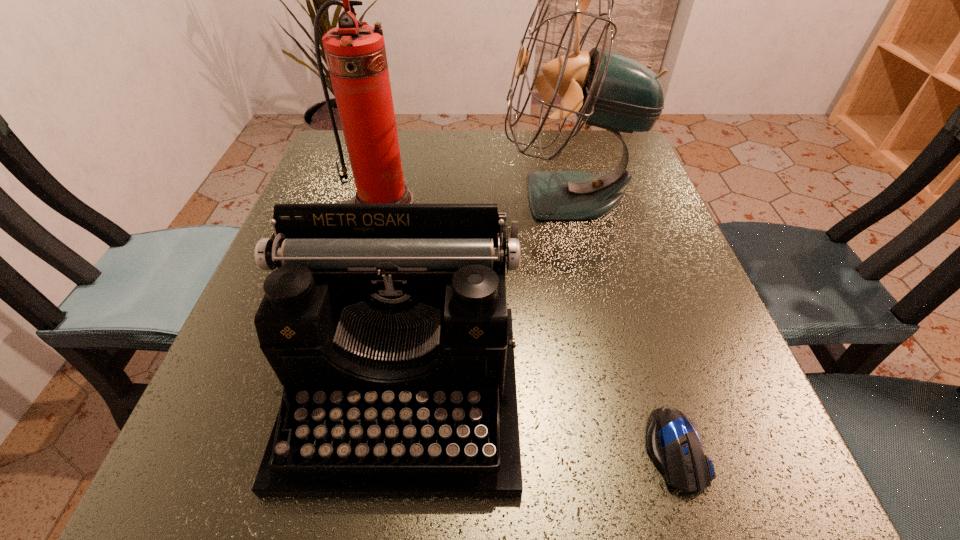
Locate an element on the screen. computer mouse at the near edge is located at coordinates (673, 442).

You are a GUI agent. You are given a task and a screenshot of the screen. Output one action in this format:
    pyautogui.click(x=<x>, y=<y>)
    Task: Click on the fire extinguisher that is at the left edge
    This screenshot has height=540, width=960.
    Given the screenshot: What is the action you would take?
    pyautogui.click(x=355, y=52)

Where is `typewriter positioned at the left edge`? This screenshot has width=960, height=540. typewriter positioned at the left edge is located at coordinates (387, 325).

Where is `fan present at the right edge`? Image resolution: width=960 pixels, height=540 pixels. fan present at the right edge is located at coordinates (604, 88).

What are the coordinates of `computer mouse located at the right edge` in the screenshot? It's located at (673, 442).

Where is `object located at the near left corner`? This screenshot has width=960, height=540. object located at the near left corner is located at coordinates (387, 325).

You are a GUI agent. You are given a task and a screenshot of the screen. Output one action in this format:
    pyautogui.click(x=<x>, y=<y>)
    Task: Click on the object situated at the far right corner
    This screenshot has height=540, width=960.
    Given the screenshot: What is the action you would take?
    pyautogui.click(x=604, y=88)

Locate an element on the screen. object present at the near right corner is located at coordinates (673, 442).

Locate an element on the screen. vacant region at the far edge of the desktop is located at coordinates (459, 159).

This screenshot has width=960, height=540. I want to click on vacant area at the left edge of the desktop, so click(244, 404).